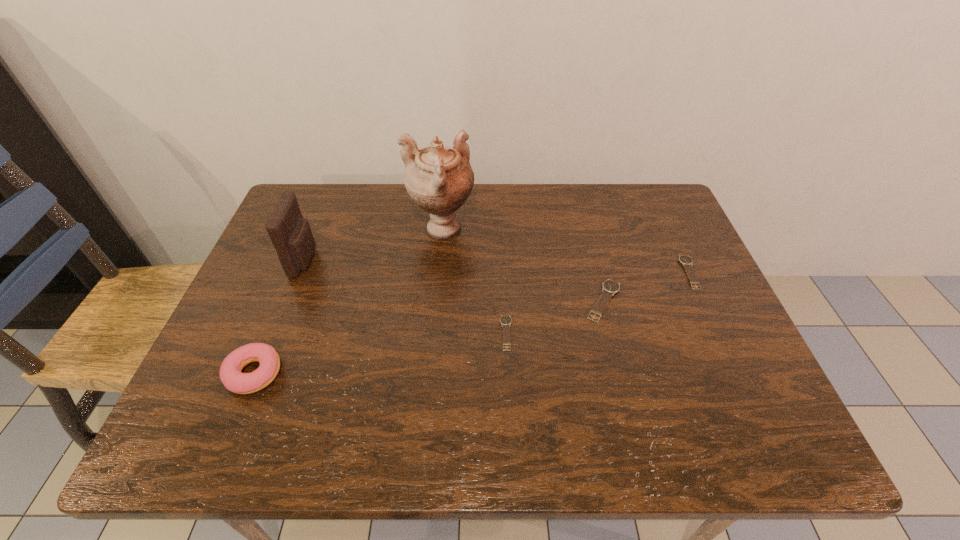
The width and height of the screenshot is (960, 540). Identify the location of the closest watch to the fifth tallest object. (609, 287).

Locate an element on the screen. This screenshot has width=960, height=540. free spot that satisfies the following two spatial constraints: 1. on the back side of the third shortest object; 2. on the left side of the third tallest object is located at coordinates (283, 301).

This screenshot has height=540, width=960. Find the location of `blank space that satisfies the following two spatial constraints: 1. with an open flap on the second tallest watch; 2. on the left side of the second tallest object`. blank space that satisfies the following two spatial constraints: 1. with an open flap on the second tallest watch; 2. on the left side of the second tallest object is located at coordinates (300, 272).

You are a GUI agent. You are given a task and a screenshot of the screen. Output one action in this format:
    pyautogui.click(x=<x>, y=<y>)
    Task: Click on the vacant space that satisfies the following two spatial constraints: 1. on the back side of the fourth shortest object; 2. on the left side of the fourth object from left to right
    
    Given the screenshot: What is the action you would take?
    pyautogui.click(x=271, y=333)

The image size is (960, 540). In order to click on free location that satisfies the following two spatial constraints: 1. on the front side of the fourth object from right to left; 2. with an open flap on the second tallest object in this screenshot , I will do `click(438, 260)`.

I want to click on free point that satisfies the following two spatial constraints: 1. with an open flap on the fourth tallest object; 2. on the left side of the pouch, so click(x=289, y=301).